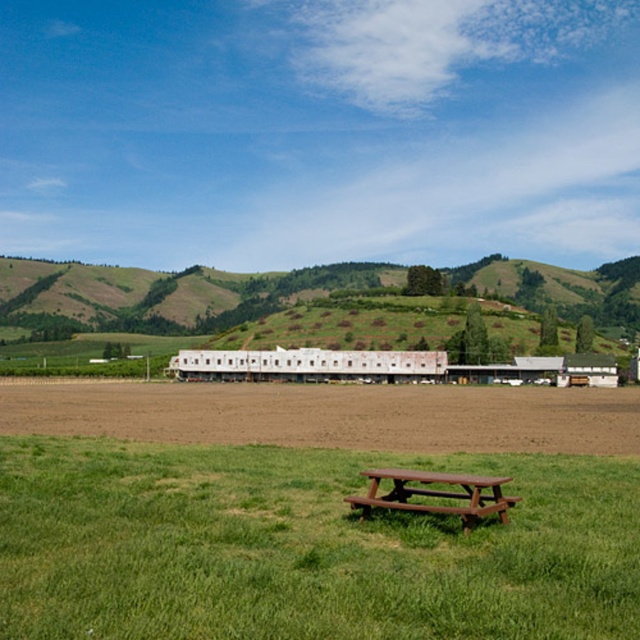
Based on the photo, can you confirm if brown soil at center is smaller than brown wooden bench at lower center?

No, brown soil at center is not smaller than brown wooden bench at lower center.

Does brown soil at center appear over brown wooden bench at lower center?

No.

You are a GUI agent. You are given a task and a screenshot of the screen. Output one action in this format:
    pyautogui.click(x=<x>, y=<y>)
    Task: Click on the brown soil at center
    
    Given the screenshot: What is the action you would take?
    pyautogui.click(x=332, y=416)

The width and height of the screenshot is (640, 640). What do you see at coordinates (305, 547) in the screenshot?
I see `green grassy field at center` at bounding box center [305, 547].

Between green grassy field at center and brown soil at center, which one has more height?

With more height is brown soil at center.

Does point (412, 467) lie behind point (305, 426)?

No, it is not.

Where is `green grassy field at center`? Image resolution: width=640 pixels, height=640 pixels. green grassy field at center is located at coordinates (305, 547).

Who is more forward, (609, 474) or (515, 499)?

Positioned in front is point (515, 499).

Locate an element on the screen. The image size is (640, 640). green grassy field at center is located at coordinates (305, 547).